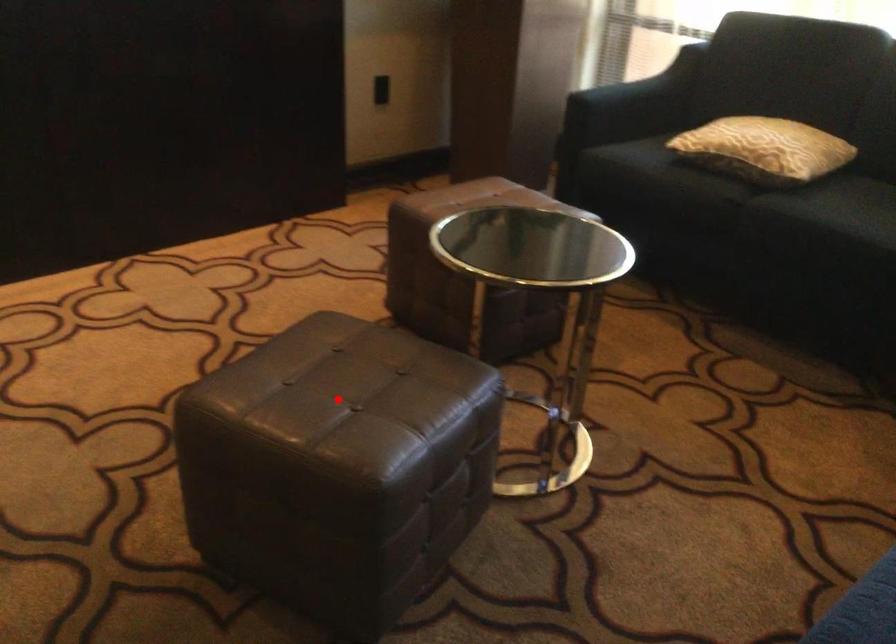
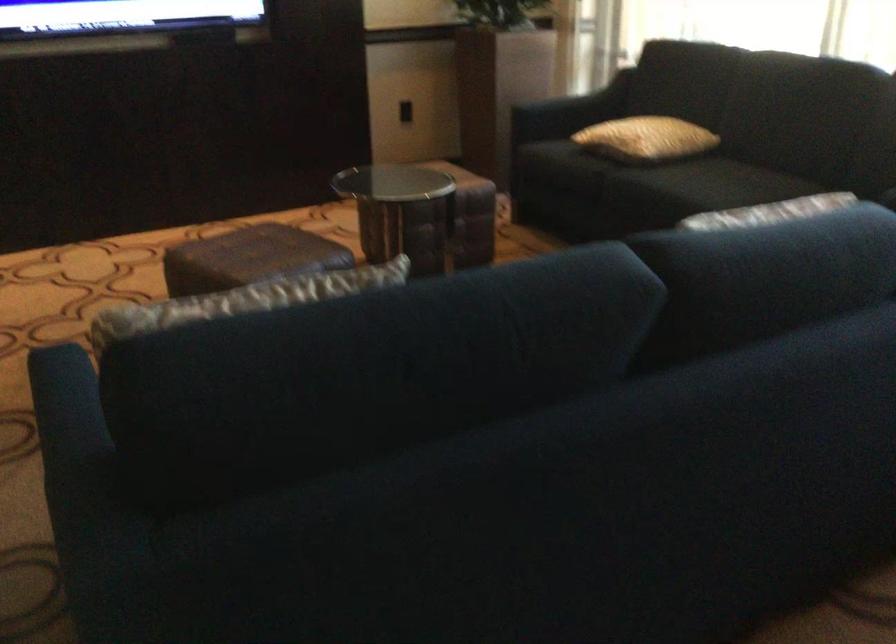
Locate, in the second image, the point that corresponds to the highlighted location in the first image.

(248, 258)